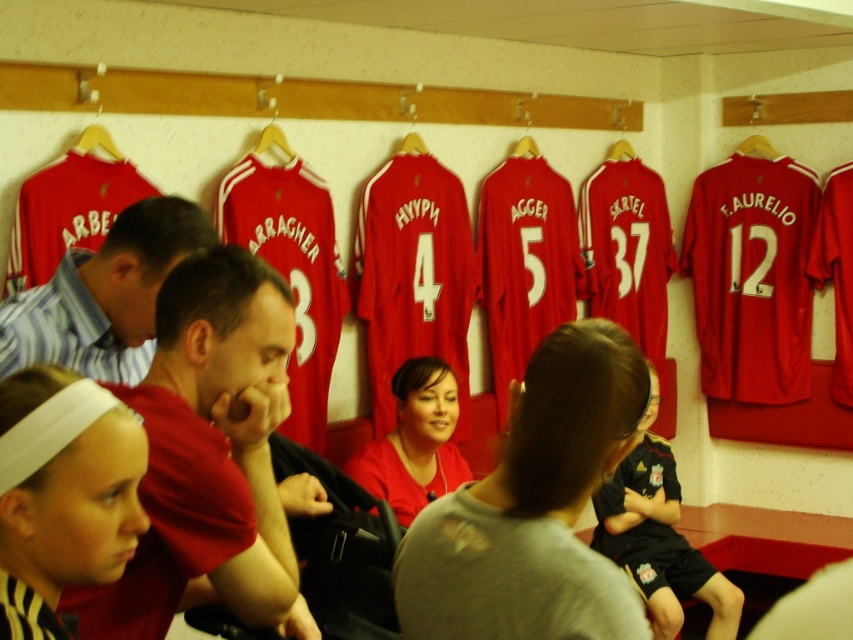
Can you confirm if matte red shirt at left is positioned above black jersey at center?

Yes.

Which is more to the right, matte red shirt at left or black jersey at center?

black jersey at center

Is point (247, 532) more distant than point (631, 508)?

No, it is not.

This screenshot has height=640, width=853. I want to click on matte red shirt at left, so click(x=207, y=452).

Who is higher up, matte blue shirt at center or black jersey at center?

matte blue shirt at center is higher up.

Is point (170, 218) closer to camera compared to point (630, 493)?

That is True.

This screenshot has width=853, height=640. What are the coordinates of `matte blue shirt at center` in the screenshot? It's located at (103, 296).

Who is higher up, matte red shirt at left or matte blue shirt at center?

matte blue shirt at center is higher up.

Does matte red shirt at left have a smaller size compared to matte blue shirt at center?

Yes, matte red shirt at left is smaller than matte blue shirt at center.

Describe the element at coordinates (207, 452) in the screenshot. I see `matte red shirt at left` at that location.

This screenshot has width=853, height=640. Identify the location of matte red shirt at left. (207, 452).